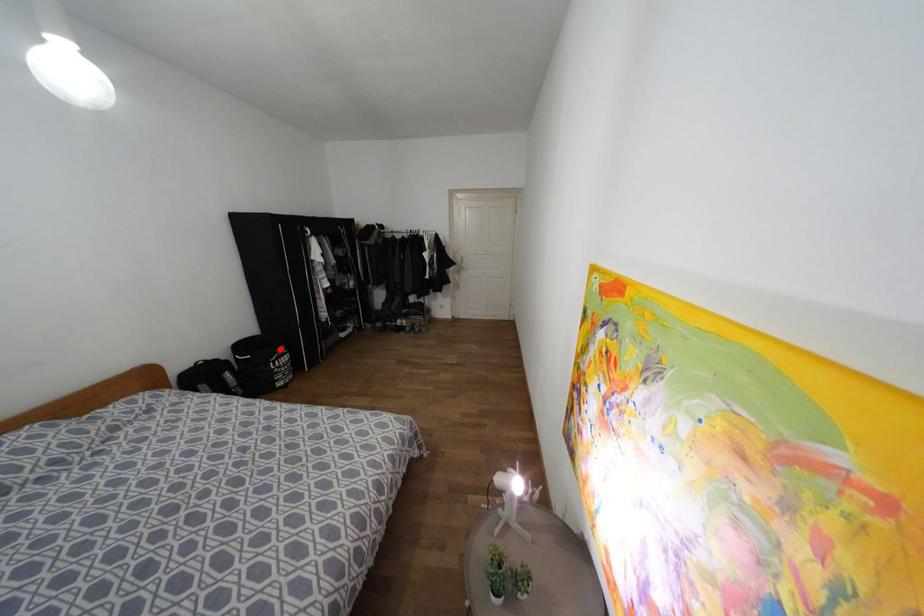
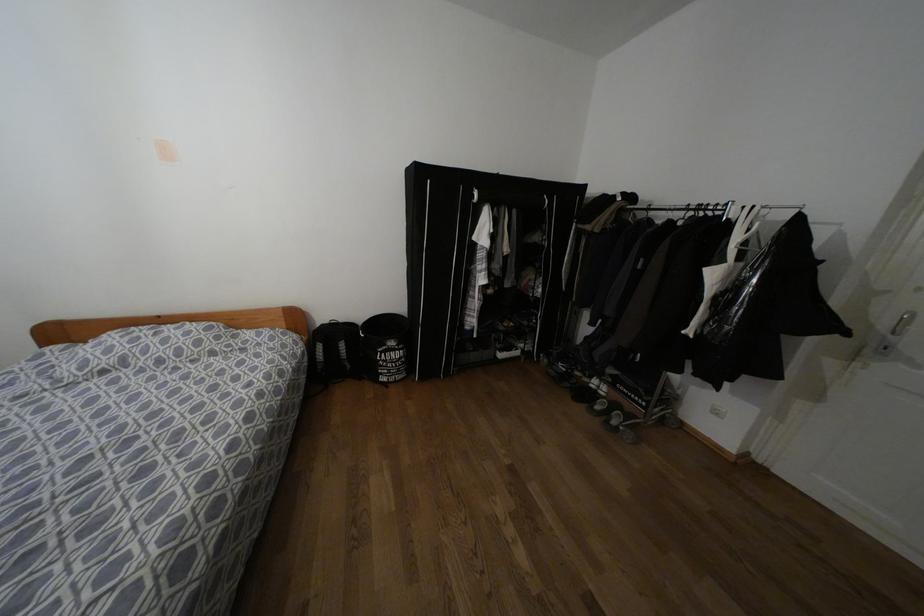
Find the pixel in the second image that matches the highlighted location in the first image.

(391, 342)